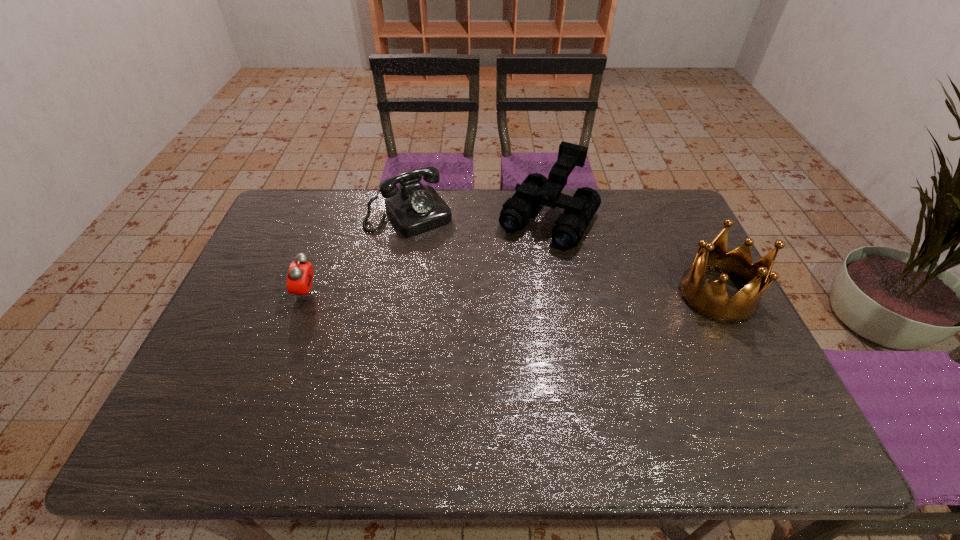
Where is `free space at the far right corner of the desktop`? free space at the far right corner of the desktop is located at coordinates (666, 221).

The image size is (960, 540). What are the coordinates of `vacant space at the near right corner of the desktop` in the screenshot? It's located at (706, 384).

This screenshot has width=960, height=540. What are the coordinates of `vacant space in between the rightmost object and the shortest object` in the screenshot? It's located at (512, 294).

Locate an element on the screen. empty space that is in between the binoculars and the second object from left to right is located at coordinates (479, 217).

Find the location of a particular element. This screenshot has height=540, width=960. vacant region between the third object from left to right and the telephone is located at coordinates (479, 217).

Image resolution: width=960 pixels, height=540 pixels. In order to click on free space between the second object from right to left and the alarm clock in this screenshot , I will do `click(428, 256)`.

What are the coordinates of `vacant area between the alarm clock and the binoculars` in the screenshot? It's located at (428, 256).

In order to click on unoccupied position between the rightmost object and the second object from left to right in this screenshot , I will do pos(564,254).

Locate an element on the screen. The image size is (960, 540). vacant space in between the crown and the second object from right to left is located at coordinates (633, 258).

Where is `vacant space that is in between the telephone and the leftmost object`? The image size is (960, 540). vacant space that is in between the telephone and the leftmost object is located at coordinates (358, 253).